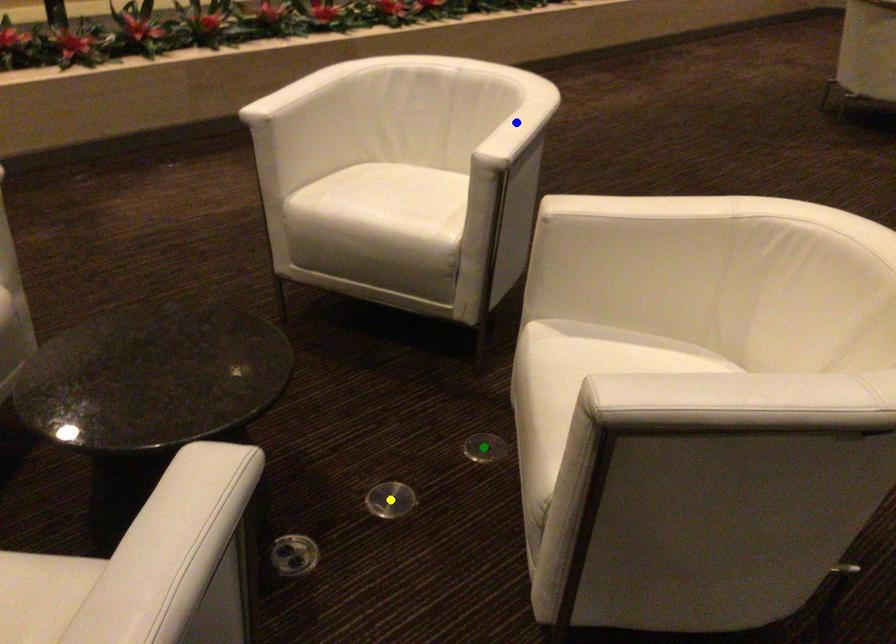
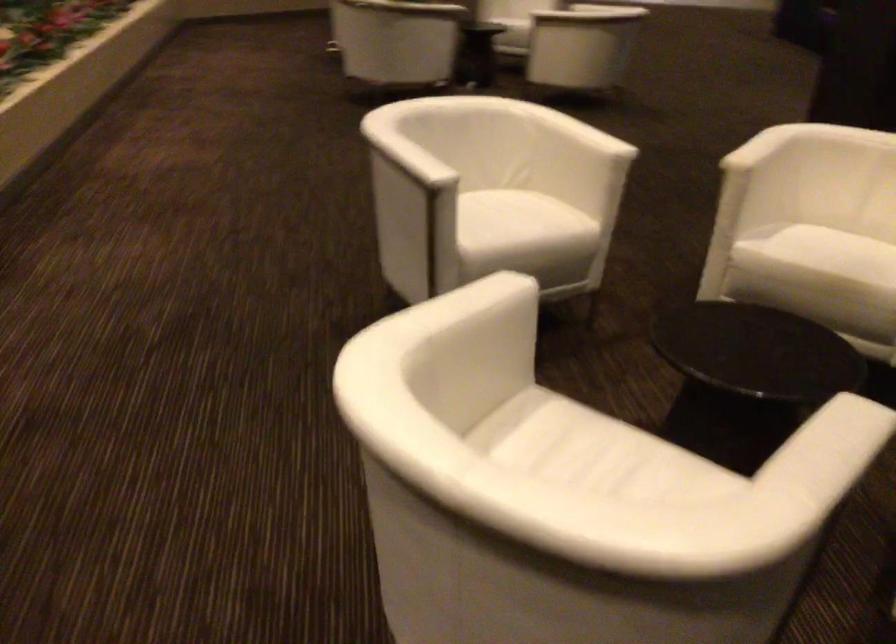
I am providing you with two images of the same scene from different viewpoints. Three points are marked in image1. Which point corresponds to a part or object that is occluded in image2?In image1, three points are marked. Which of them correspond to a part or object that is occluded in image2?Among the three points shown in image1, which one corresponds to a part or object that is no longer visible due to occlusion in image2?

Invisible in image2: blue point, green point, yellow point.